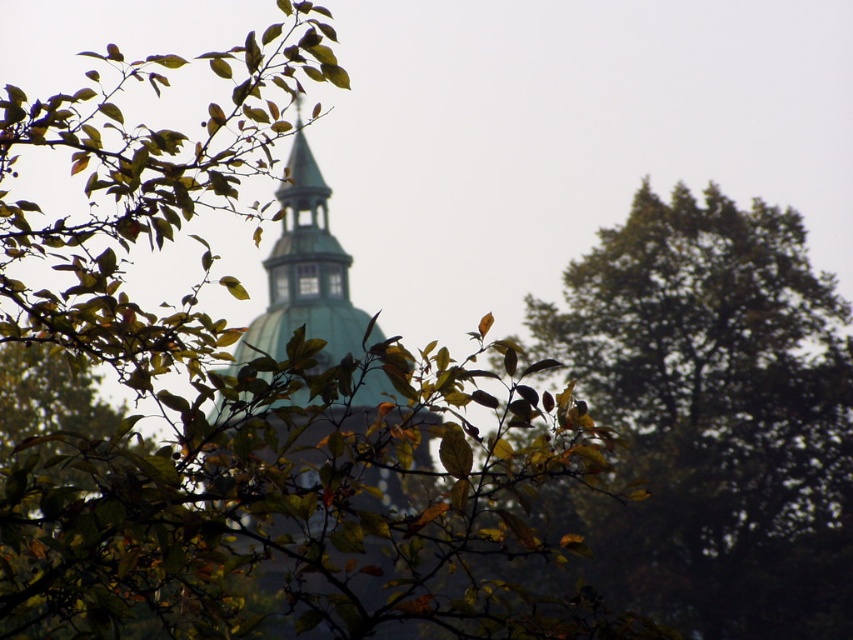
Based on the photo, you are standing in the outdoor scene looking at the tree and the dome roof building. There are two points marked in the image. Which point is closer to you, point [840,408] or point [357,499]?

Point [840,408] is closer to the viewer than point [357,499].